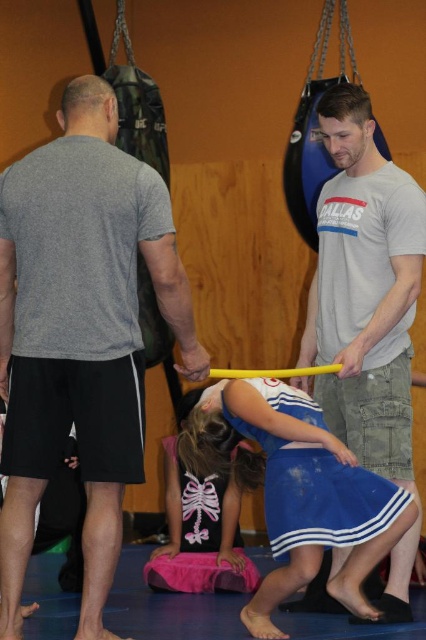
You are standing in the gym and see the point marked at coordinates (368, 308). What object is located at that point?

The point at coordinates (368, 308) corresponds to the matte gray t shirt at center.